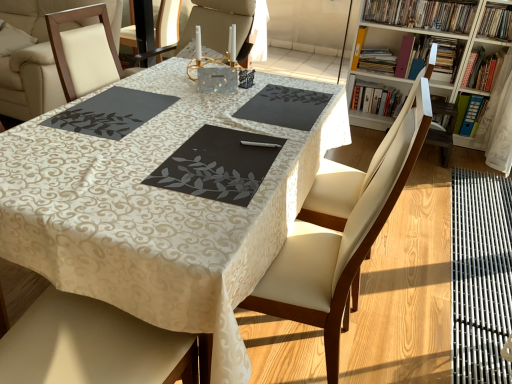
Identify the location of unoccupied region to the right of dark gray matte placemat at center, the third place mat positioned from the right. (198, 124).